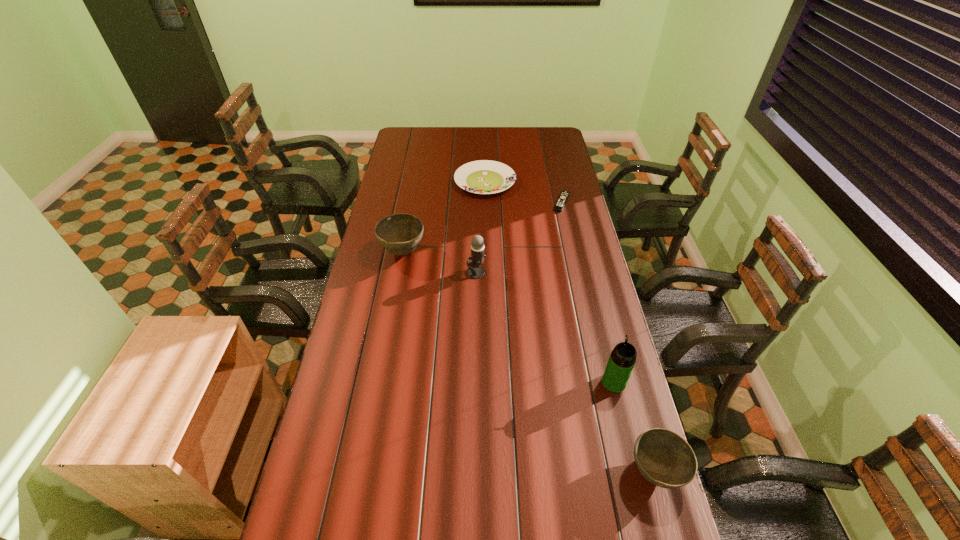
At what (x,y) coordinates should I click in order to perform the action: click on thermos bottle situated at the right edge. Please return your answer as a coordinate pair (x, y). Looking at the image, I should click on (621, 362).

Find the location of a particular element. Image resolution: width=960 pixels, height=540 pixels. object present at the near right corner is located at coordinates (665, 459).

In the image, there is a desktop. Where is `free space at the far edge`? free space at the far edge is located at coordinates click(x=488, y=145).

In the image, there is a desktop. Where is `vacant space at the near edge`? The height and width of the screenshot is (540, 960). vacant space at the near edge is located at coordinates (487, 482).

Locate an element on the screen. free space at the left edge is located at coordinates (371, 246).

Identify the location of free space at the right edge of the desktop. The image size is (960, 540). (598, 424).

Image resolution: width=960 pixels, height=540 pixels. I want to click on vacant space in between the fifth tallest object and the microphone, so click(481, 227).

This screenshot has height=540, width=960. I want to click on free space between the microphone and the second shortest object, so pyautogui.click(x=481, y=227).

This screenshot has height=540, width=960. Identify the location of free space between the left bowl and the nearest object. (529, 362).

What are the coordinates of `vacant space that's between the nearest object and the microphone` in the screenshot? It's located at (565, 372).